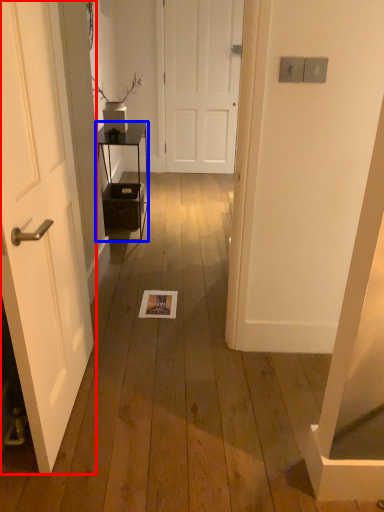
Question: Which point is closer to the camera, door (highlighted by a red box) or furniture (highlighted by a blue box)?

Choices:
 (A) door
 (B) furniture

Answer: (A)